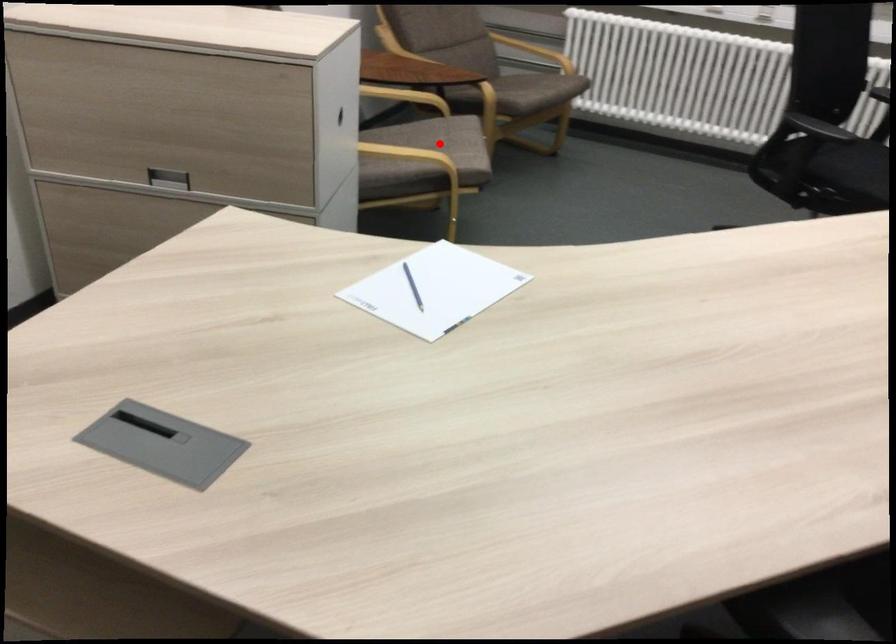
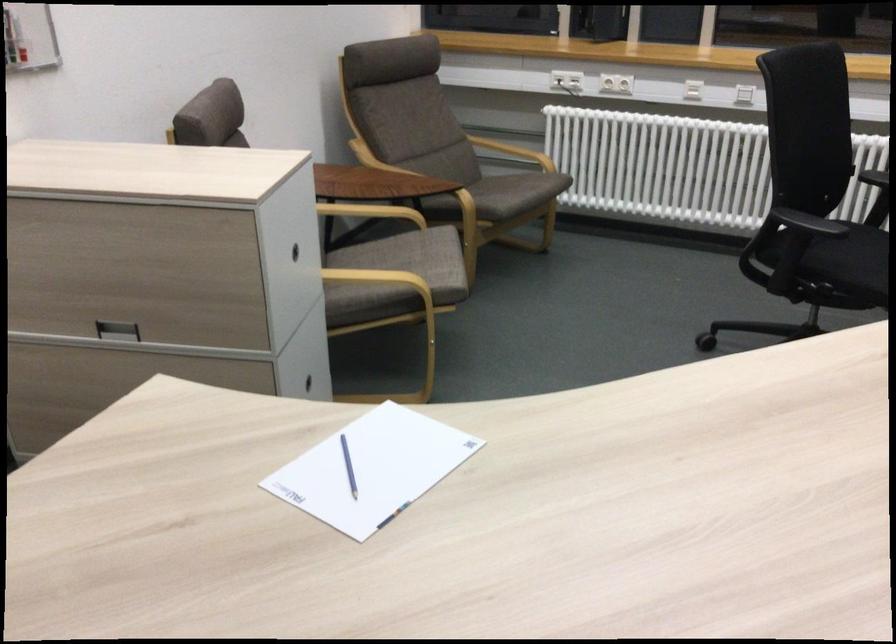
Find the pixel in the second image that matches the highlighted location in the first image.

(412, 259)